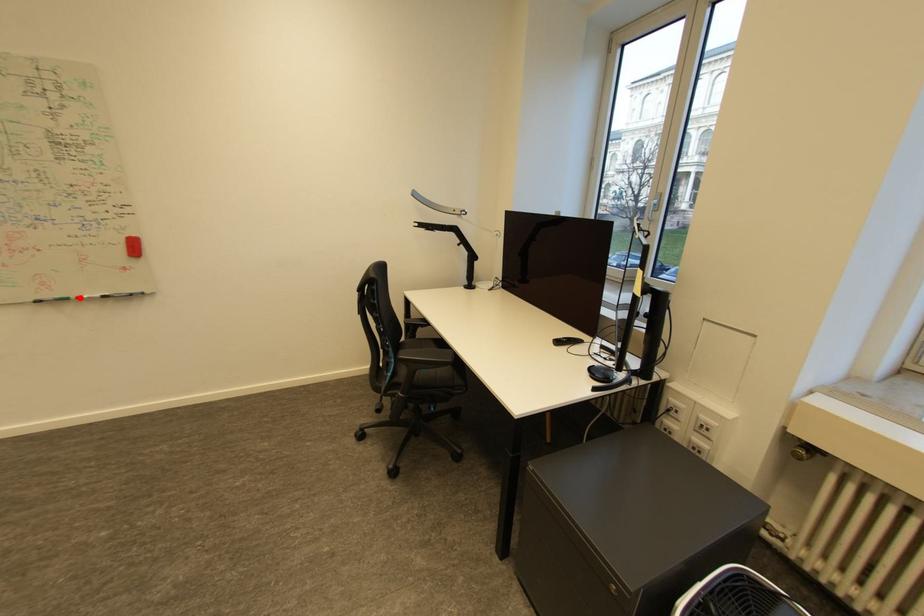
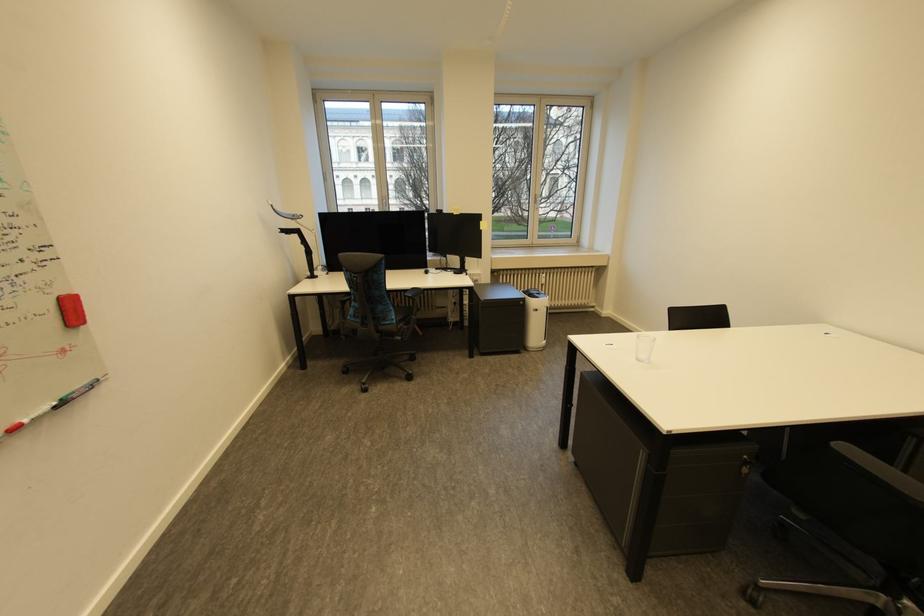
Question: I am providing you with two images of the same scene from different viewpoints. A red point is marked on the first image. Can you still see the location of the red point in image 2?

Choices:
 (A) Yes
 (B) No

Answer: (A)